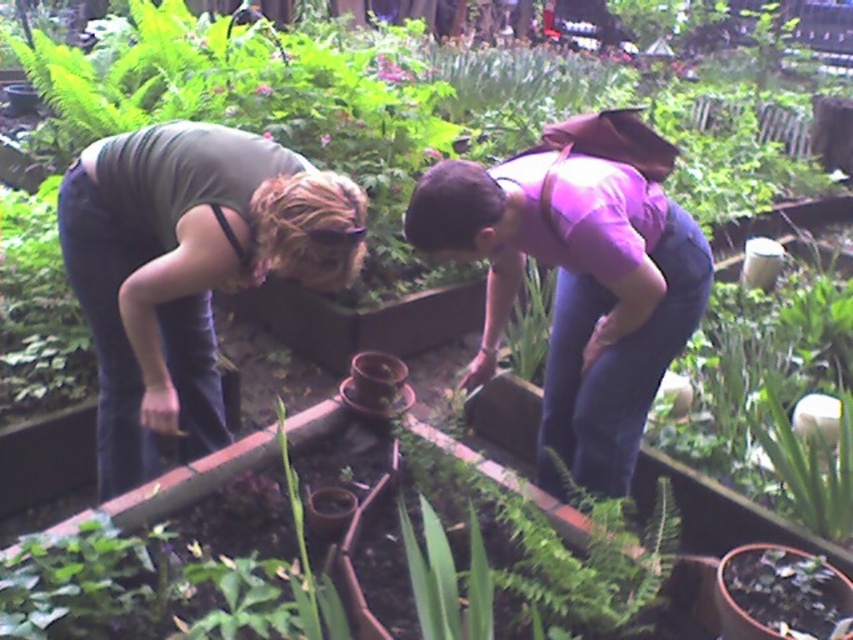
Question: Which point is farther from the camera taking this photo?

Choices:
 (A) (514, 160)
 (B) (848, 586)
 (C) (77, 160)

Answer: (A)

Question: Is matte green shirt at left closer to camera compared to purple matte shirt at center?

Choices:
 (A) yes
 (B) no

Answer: (A)

Question: Among these points, which one is nearest to the camera?

Choices:
 (A) (299, 221)
 (B) (601, 250)
 (C) (769, 634)

Answer: (C)

Question: In this image, where is matte green shirt at left located relative to green matte plant at center?

Choices:
 (A) below
 (B) above

Answer: (B)

Question: Can you confirm if matte green shirt at left is bigger than purple matte shirt at center?

Choices:
 (A) no
 (B) yes

Answer: (A)

Question: Among these points, which one is nearest to the camera?

Choices:
 (A) (158, 401)
 (B) (624, 276)

Answer: (B)